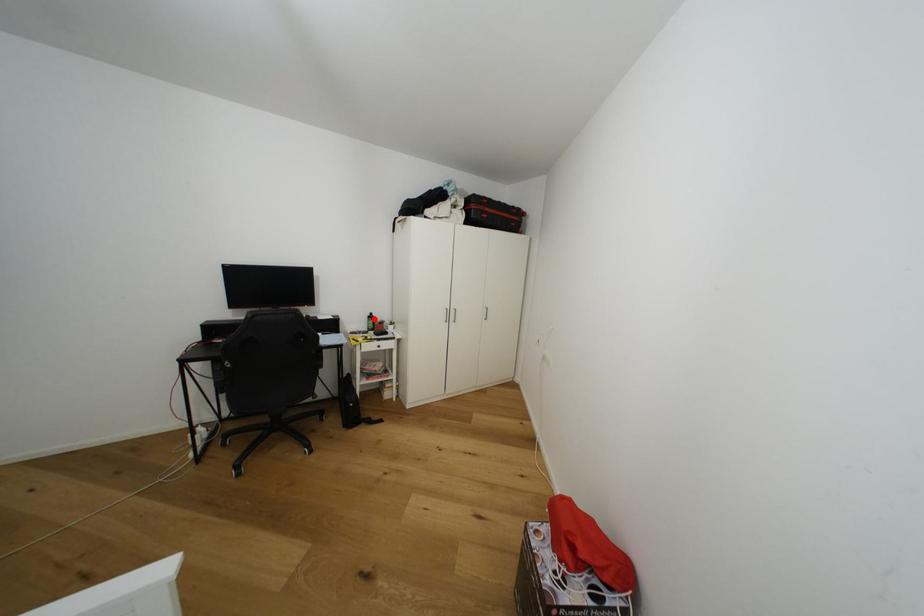
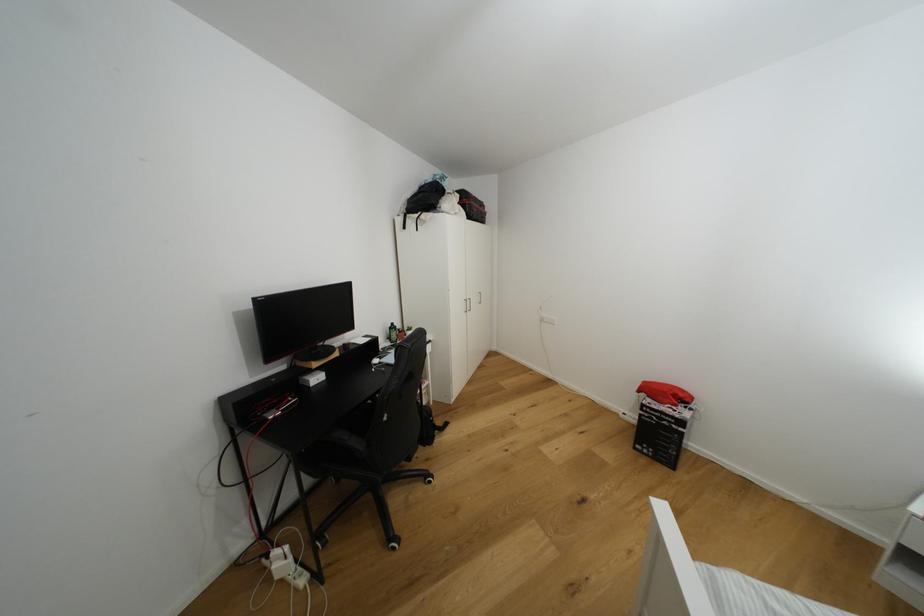
The point at the highlighted location is marked in the first image. Where is the corresponding point in the second image?

(395, 330)